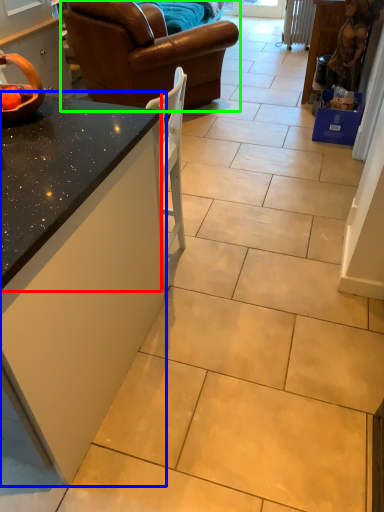
Question: Based on their relative distances, which object is farther from countertop (highlighted by a red box)? Choose from countertop (highlighted by a blue box) and studio couch (highlighted by a green box).

Choices:
 (A) countertop
 (B) studio couch

Answer: (B)